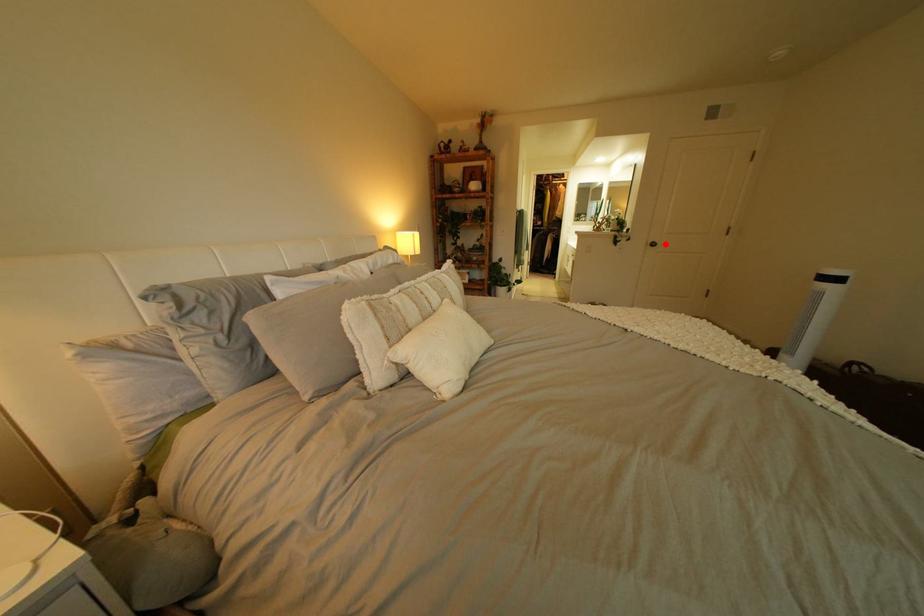
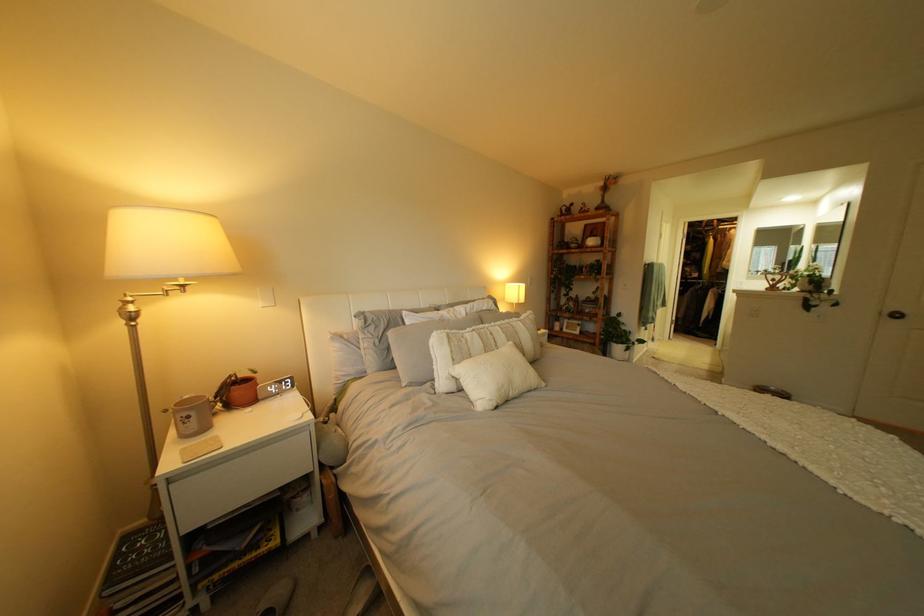
Question: I am providing you with two images of the same scene from different viewpoints. Image1 has a red point marked. In image2, the corresponding 3D location appears at what relative position? Reply with the corresponding letter.

Choices:
 (A) Closer
 (B) Farther

Answer: (B)